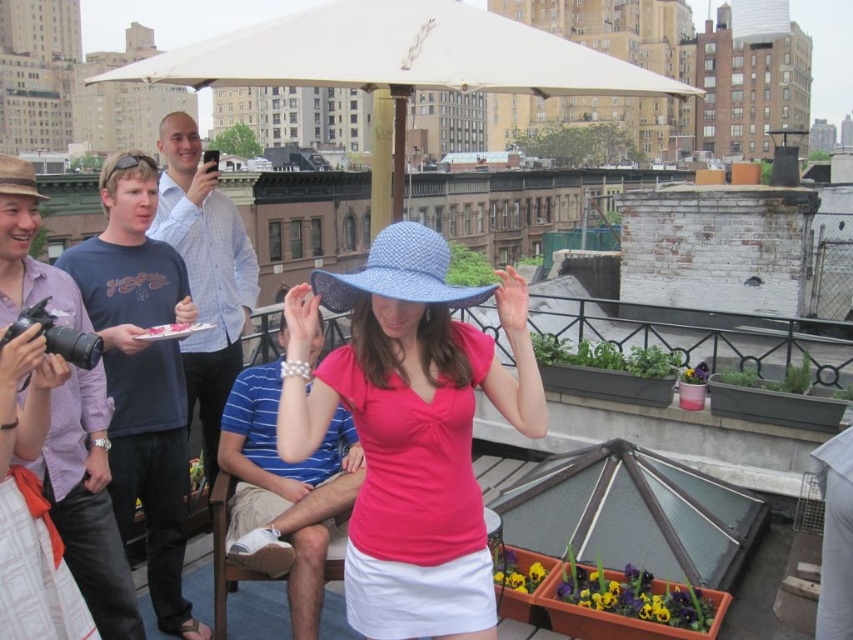
Question: From the image, what is the correct spatial relationship of white fabric canopy at upper center in relation to dark blue t-shirt at center?

Choices:
 (A) right
 (B) left

Answer: (A)

Question: Which point is closer to the camera taking this photo?

Choices:
 (A) (73, 417)
 (B) (473, 516)
 (C) (259, 461)

Answer: (A)

Question: Can you confirm if white fabric umbrella at upper center is wider than white paper plate at center?

Choices:
 (A) no
 (B) yes

Answer: (B)

Question: Considering the real-world distances, which object is farthest from the blue denim jeans at left?

Choices:
 (A) white fabric umbrella at upper center
 (B) white paper plate at center

Answer: (A)

Question: In this image, where is matte blue fabric hat at center located relative to blue shirt at left?

Choices:
 (A) left
 (B) right

Answer: (B)

Question: Which object is the closest to the blue shirt at left?

Choices:
 (A) white fabric umbrella at upper center
 (B) blue striped shirt at center
 (C) white fabric canopy at upper center
 (D) dark blue t-shirt at center

Answer: (D)